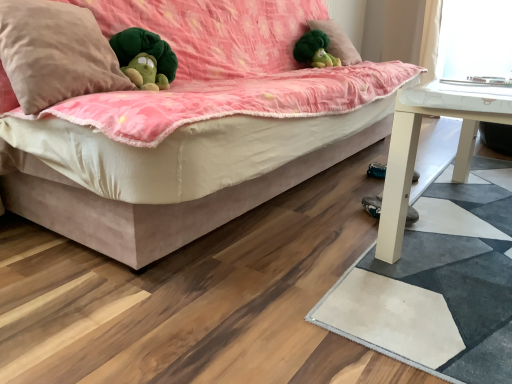
Identify the location of free space above white matte mat at lower right (from a real-world perspective). (448, 257).